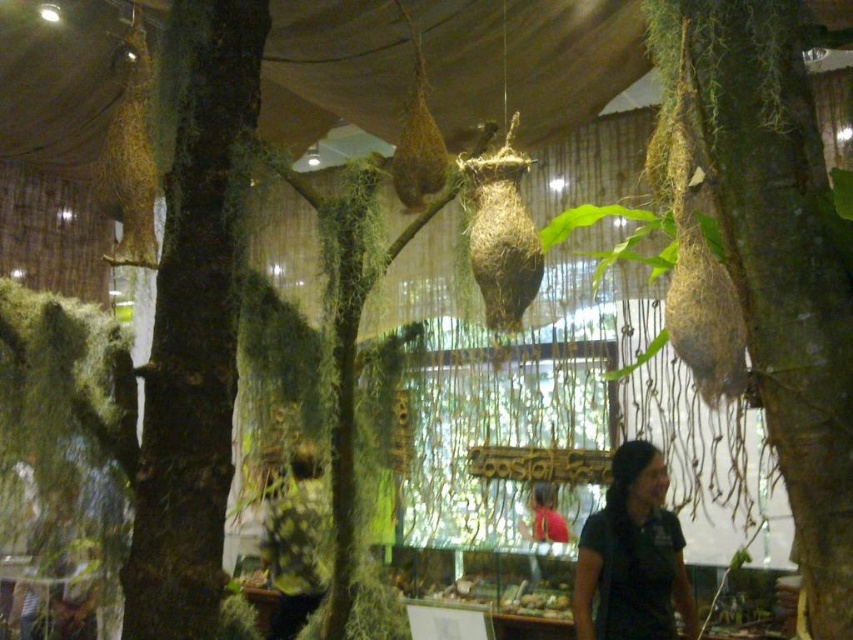
Consider the image. You are an ornithologist examining the museum exhibit. You notice the green mossy tree at center and the dark brown bark at center. Which object is positioned higher in the image?

The green mossy tree at center is above the dark brown bark at center, so it is positioned higher in the image.

You are a visitor in the museum and want to take a photo of both the black matte shirt at lower right and the dark brown leather shirt at lower center. However, you can only focus on one object at a time. Which shirt should you focus on first to ensure both are in the frame?

You should focus on the black matte shirt at lower right first because it is closer to the viewer than the dark brown leather shirt at lower center. By focusing on the closer object, you can ensure that both shirts are within the depth of field and appear sharp in the photo.

Consider the image. You are standing in the museum exhibit and want to take a photo of the black matte shirt at lower right. Where should you position yourself to capture it in the frame?

The black matte shirt at lower right is located at coordinates point [631,556], so you should position yourself to the lower right of the exhibit to capture it in the frame.